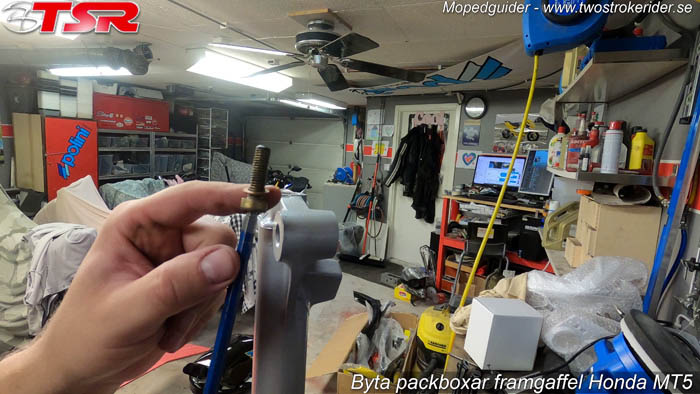
Identify the location of walkway entry door. This screenshot has width=700, height=394. (411, 212).